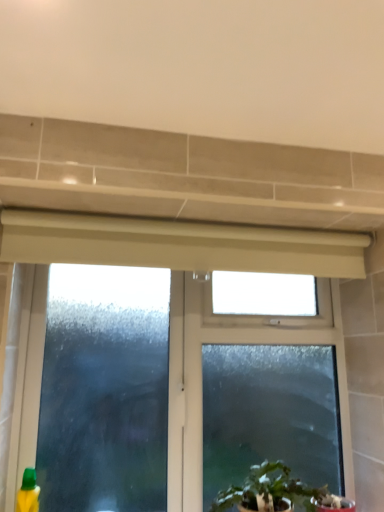
Question: Is frosted glass window at center facing away from green plastic bottle at lower left?

Choices:
 (A) no
 (B) yes

Answer: (A)

Question: Does frosted glass window at center have a smaller size compared to green plastic bottle at lower left?

Choices:
 (A) no
 (B) yes

Answer: (A)

Question: Is frosted glass window at center wider than green plastic bottle at lower left?

Choices:
 (A) yes
 (B) no

Answer: (B)

Question: Is frosted glass window at center at the right side of green plastic bottle at lower left?

Choices:
 (A) yes
 (B) no

Answer: (A)

Question: Considering the relative sizes of frosted glass window at center and green plastic bottle at lower left in the image provided, is frosted glass window at center bigger than green plastic bottle at lower left?

Choices:
 (A) yes
 (B) no

Answer: (A)

Question: From the image's perspective, is frosted glass window at center located above green plastic bottle at lower left?

Choices:
 (A) yes
 (B) no

Answer: (A)

Question: From the image's perspective, is green plastic bottle at lower left on frosted glass window at center?

Choices:
 (A) no
 (B) yes

Answer: (A)

Question: Can you confirm if green plastic bottle at lower left is wider than frosted glass window at center?

Choices:
 (A) no
 (B) yes

Answer: (B)

Question: Is green plastic bottle at lower left further to camera compared to frosted glass window at center?

Choices:
 (A) no
 (B) yes

Answer: (A)

Question: Does green plastic bottle at lower left have a larger size compared to frosted glass window at center?

Choices:
 (A) no
 (B) yes

Answer: (A)

Question: Does green plastic bottle at lower left appear on the right side of frosted glass window at center?

Choices:
 (A) yes
 (B) no

Answer: (B)

Question: Would you say green plastic bottle at lower left is a long distance from frosted glass window at center?

Choices:
 (A) yes
 (B) no

Answer: (B)

Question: Is green leafy plant at lower center positioned before green plastic bottle at lower left?

Choices:
 (A) no
 (B) yes

Answer: (B)